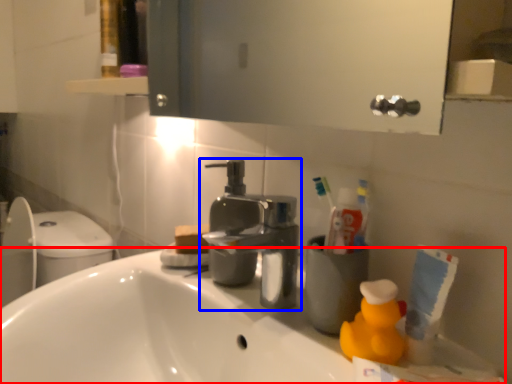
Question: Which point is closer to the camera, counter top (highlighted by a red box) or tap (highlighted by a blue box)?

Choices:
 (A) counter top
 (B) tap

Answer: (A)